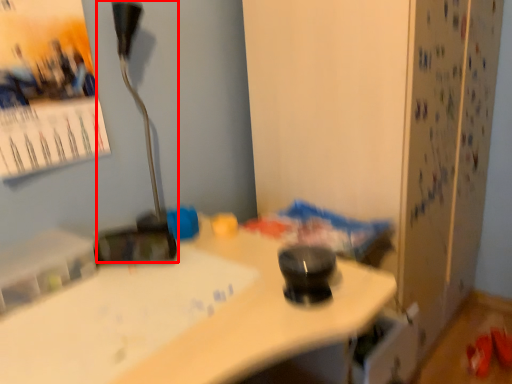
Question: From the image's perspective, where is lamp (annotated by the red box) located in relation to poster page in the image?

Choices:
 (A) above
 (B) below

Answer: (B)